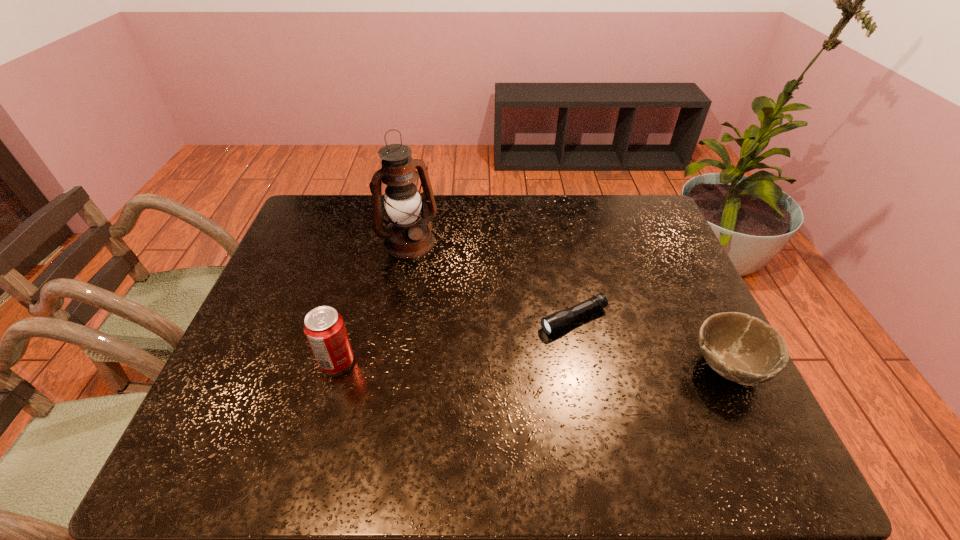
The width and height of the screenshot is (960, 540). I want to click on the third shortest object, so click(324, 327).

Where is `the rightmost object`? The image size is (960, 540). the rightmost object is located at coordinates (743, 349).

The width and height of the screenshot is (960, 540). Find the location of `bowl`. bowl is located at coordinates (743, 349).

Where is `the shortest object`? the shortest object is located at coordinates (552, 323).

Where is `the third object from left to right`? The image size is (960, 540). the third object from left to right is located at coordinates (552, 323).

This screenshot has height=540, width=960. What are the coordinates of `lantern` in the screenshot? It's located at (408, 235).

This screenshot has height=540, width=960. Identify the location of the tallest object. (408, 235).

Locate an element on the screen. free space located on the right of the second tallest object is located at coordinates (472, 362).

Locate an element on the screen. The image size is (960, 540). vacant space located on the back of the bowl is located at coordinates (673, 251).

The width and height of the screenshot is (960, 540). In order to click on free location located 0.180m at the lens end of the third object from left to right in this screenshot , I will do `click(483, 357)`.